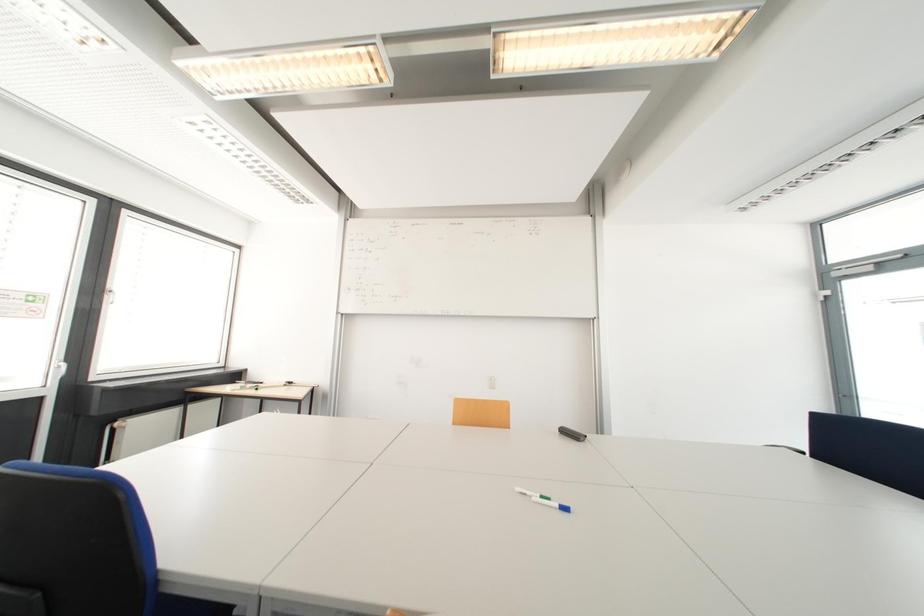
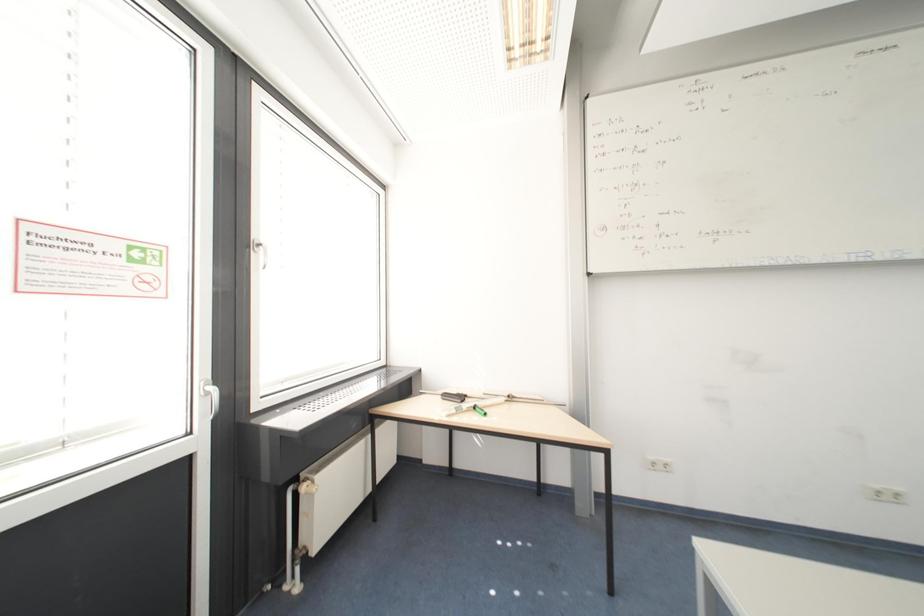
Based on the photo, the images are taken continuously from a first-person perspective. In which direction are you moving?

The movement direction of the cameraman is left, forward.